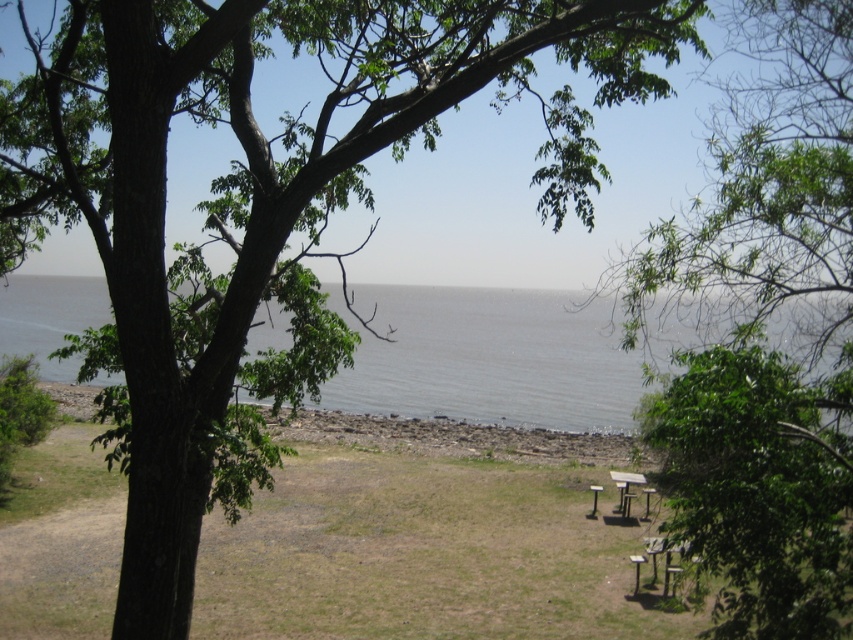
You are planning to set up a picnic table in this outdoor area. Based on the scene, which object would cast a longer shadow at noon? Please consider the green leafy tree at upper center and the brown wooden table at lower right.

The green leafy tree at upper center is much taller than the brown wooden table at lower right, so it would cast a longer shadow at noon.

You are standing on the grassy area and want to take a photo of the green leafy tree at upper center and the gray water at center. Which object should you zoom in more on to capture both in the frame?

Since the green leafy tree at upper center is smaller than the gray water at center, you should zoom in more on the gray water at center to ensure both fit in the frame.